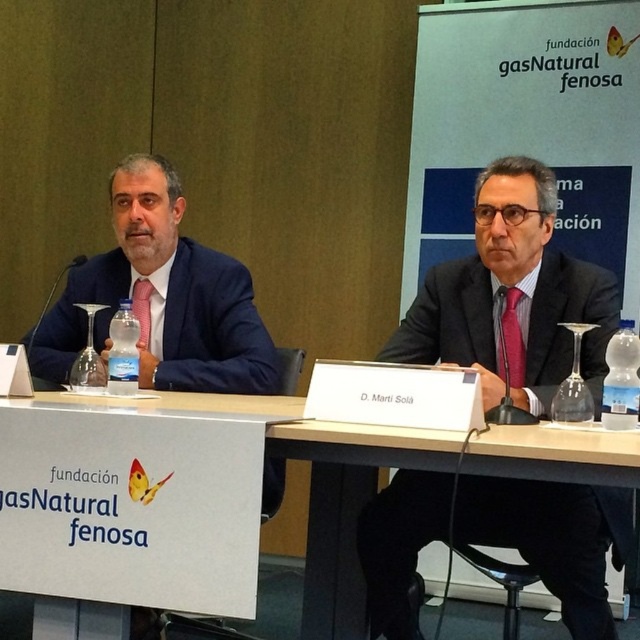
Question: Does dark blue suit at center come in front of matte black suit at left?

Choices:
 (A) yes
 (B) no

Answer: (A)

Question: Based on their relative distances, which object is farther from the dark blue suit at center?

Choices:
 (A) matte black suit at left
 (B) white plastic table at center
 (C) brown wooden table at center

Answer: (A)

Question: Can you confirm if dark blue suit at center is wider than matte black suit at left?

Choices:
 (A) no
 (B) yes

Answer: (A)

Question: Which of the following is the farthest from the observer?

Choices:
 (A) white plastic table at center
 (B) dark blue suit at center

Answer: (B)

Question: Which point is closer to the camera taking this photo?

Choices:
 (A) (321, 586)
 (B) (625, 515)
 (C) (193, 561)
 (D) (141, 163)

Answer: (C)

Question: Is dark blue suit at center to the right of matte black suit at left from the viewer's perspective?

Choices:
 (A) no
 (B) yes

Answer: (B)